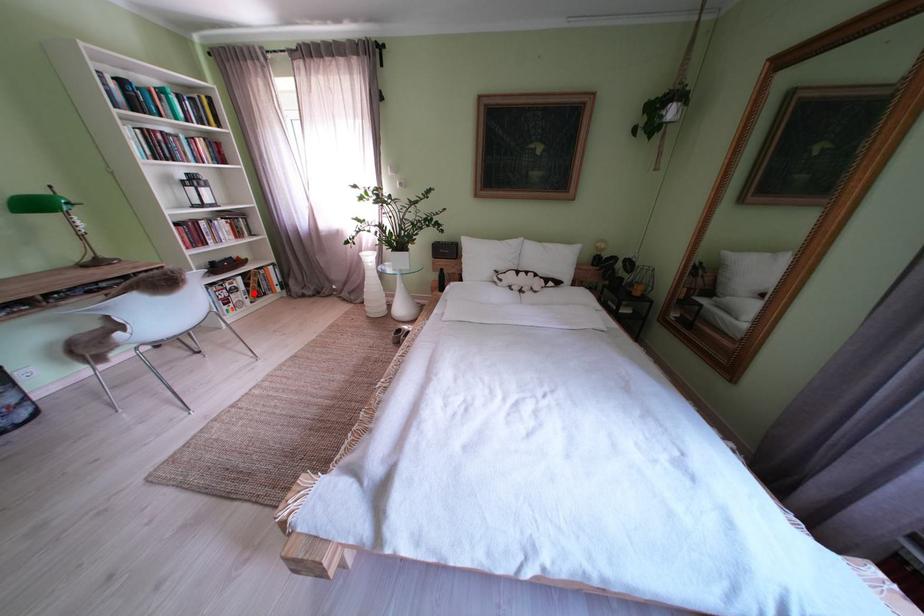
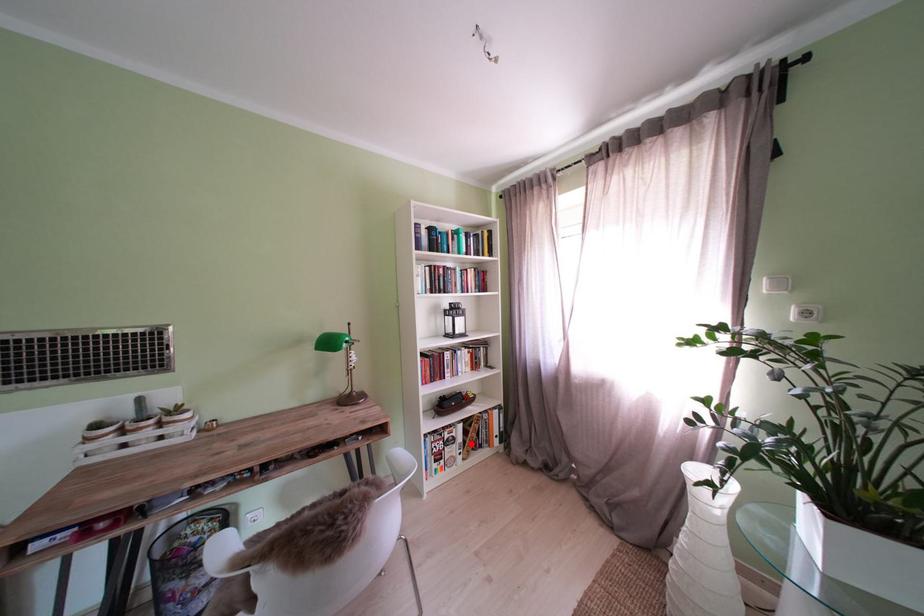
I am providing you with two images of the same scene from different viewpoints. A red point is marked on the first image and another point is marked on the second image. Do the highlighted points in image1 and image2 indicate the same real-world spot?

Yes